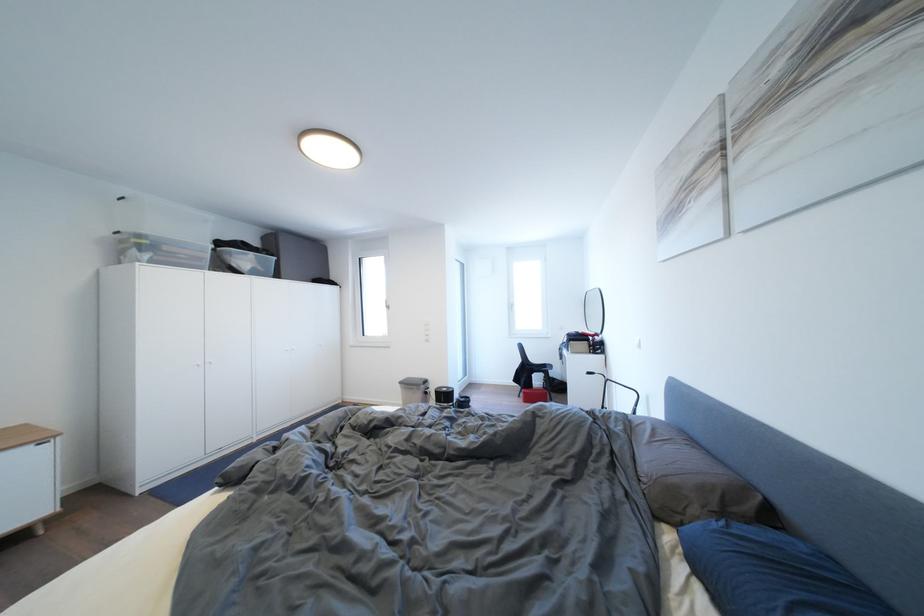
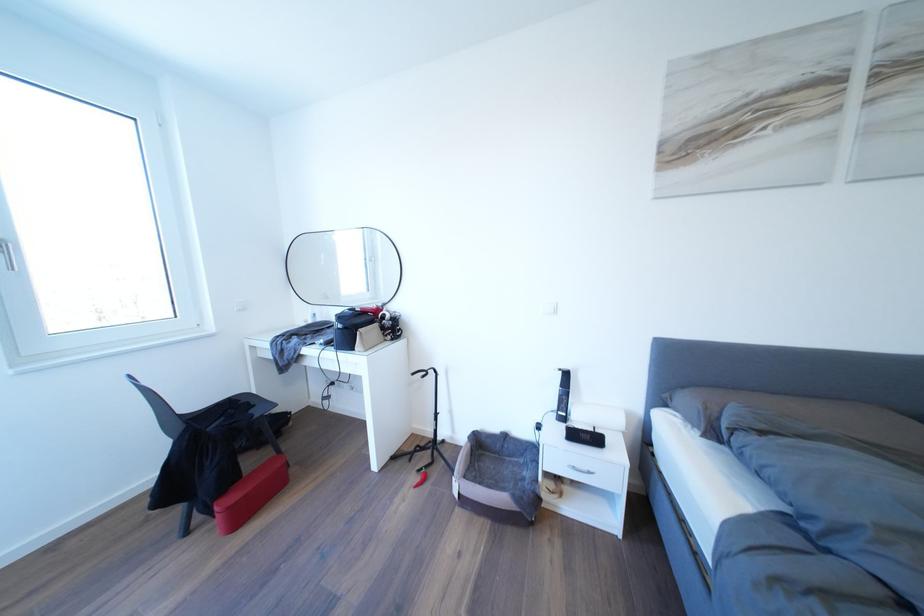
The point at (518,310) is marked in the first image. Where is the corresponding point in the second image?

(6, 254)